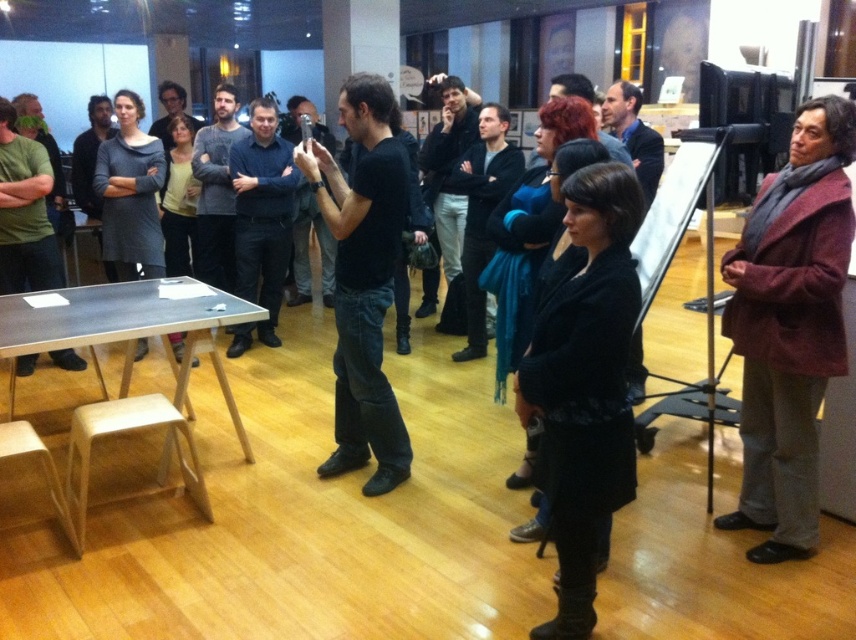
Is point (557, 588) positioned in front of point (70, 524)?

Yes, point (557, 588) is in front of point (70, 524).

Who is positioned more to the right, black matte coat at center or wooden stool at lower left?

From the viewer's perspective, black matte coat at center appears more on the right side.

The height and width of the screenshot is (640, 856). What do you see at coordinates (586, 387) in the screenshot? I see `black matte coat at center` at bounding box center [586, 387].

You are a GUI agent. You are given a task and a screenshot of the screen. Output one action in this format:
    pyautogui.click(x=<x>, y=<y>)
    Task: Click on the black matte coat at center
    This screenshot has height=640, width=856.
    Given the screenshot: What is the action you would take?
    pyautogui.click(x=586, y=387)

Can you confirm if matte black table at left is positioned to the right of wooden stool at lower left?

No, matte black table at left is not to the right of wooden stool at lower left.

I want to click on matte black table at left, so click(x=24, y=212).

Who is more distant from viewer, (45, 161) or (43, 456)?

The point (45, 161) is behind.

Locate an element on the screen. matte black table at left is located at coordinates (24, 212).

Does maroon woolen coat at right have a greater height compared to black matte coat at center?

Yes, maroon woolen coat at right is taller than black matte coat at center.

Which is below, maroon woolen coat at right or black matte coat at center?

Positioned lower is black matte coat at center.

Is point (800, 522) positioned before point (586, 540)?

No.

You are a GUI agent. You are given a task and a screenshot of the screen. Output one action in this format:
    pyautogui.click(x=<x>, y=<y>)
    Task: Click on the maroon woolen coat at right
    The image size is (856, 640).
    Given the screenshot: What is the action you would take?
    pyautogui.click(x=789, y=326)